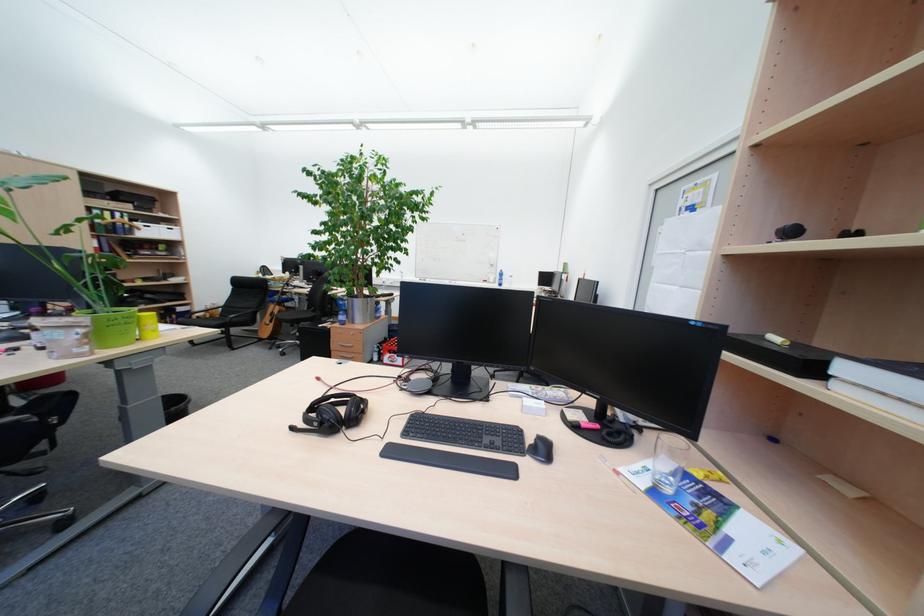
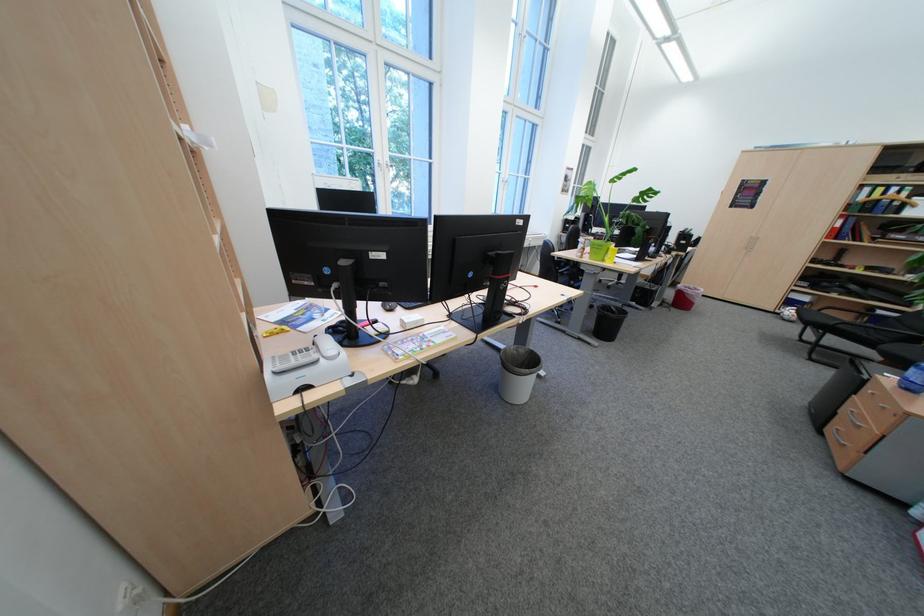
The point at (102, 209) is marked in the first image. Where is the corresponding point in the second image?

(873, 188)